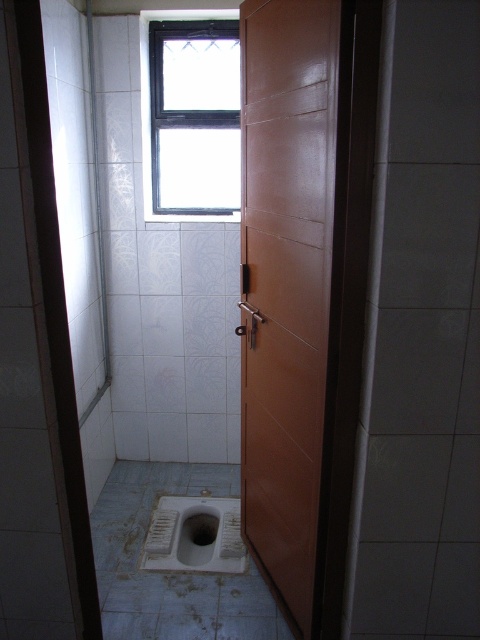
Consider the image. You are a delivery robot with a height of 1.5 meters. You need to enter the bathroom through the glossy wood door at center. However, there is a clear glass window at upper center above the door. Will the robot hit its head on the window when passing through the door?

The distance between the glossy wood door at center and the clear glass window at upper center is 1.04 meters. Since the robot is 1.5 meters tall, it will hit its head on the window when passing through the door because the space between the door and the window is less than the robot height.